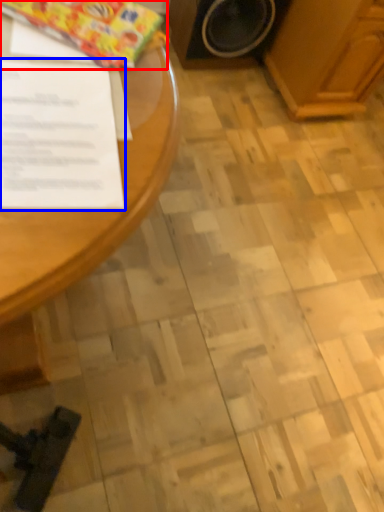
Question: Which object is closer to the camera taking this photo, wrapping paper (highlighted by a red box) or document (highlighted by a blue box)?

Choices:
 (A) wrapping paper
 (B) document

Answer: (B)